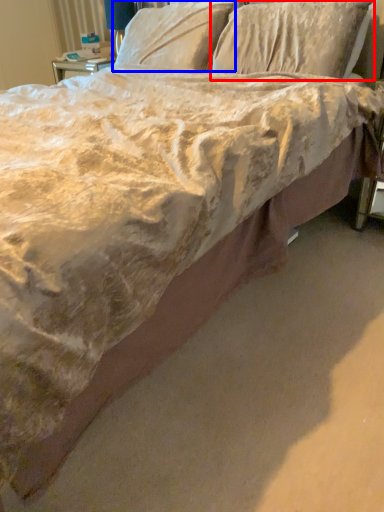
Question: Which point is closer to the camera, pillow (highlighted by a red box) or pillow (highlighted by a blue box)?

Choices:
 (A) pillow
 (B) pillow

Answer: (A)